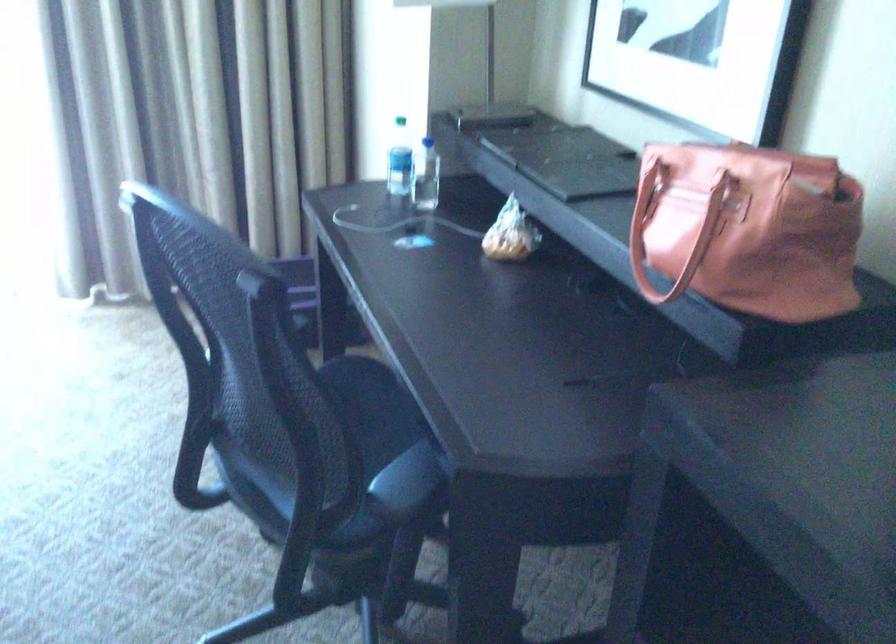
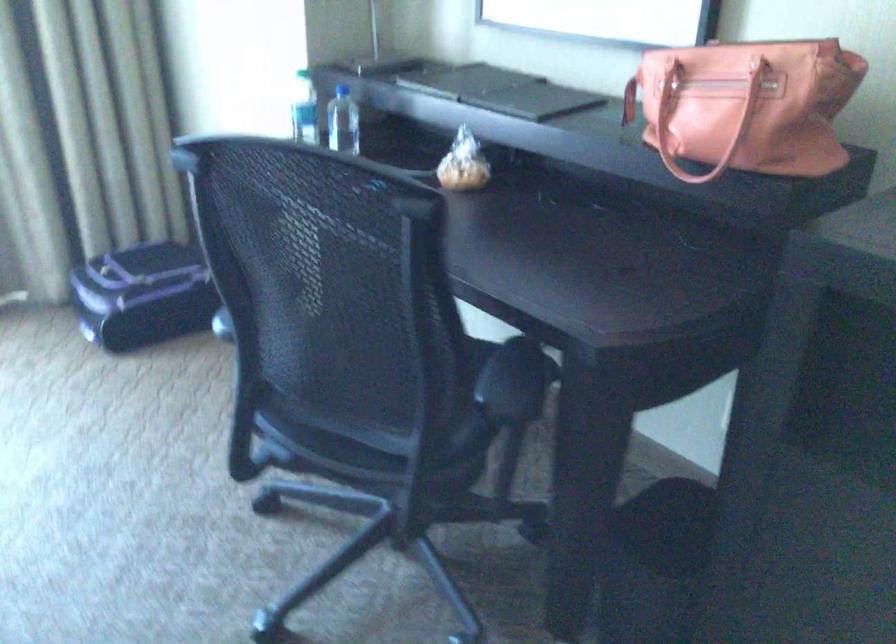
The point at (278, 498) is marked in the first image. Where is the corresponding point in the second image?

(364, 440)